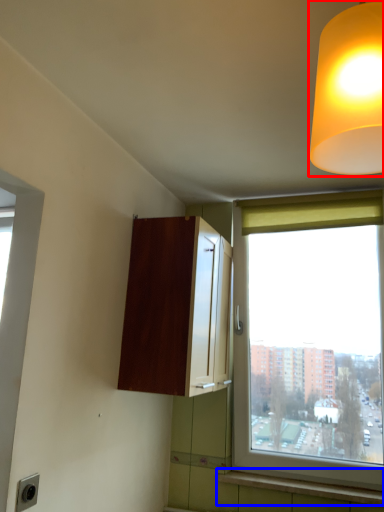
Question: Among these objects, which one is nearest to the camera, lamp (highlighted by a red box) or window sill (highlighted by a blue box)?

Choices:
 (A) lamp
 (B) window sill

Answer: (A)